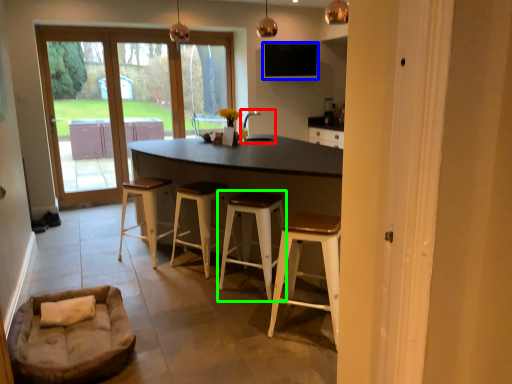
Question: Which is nearer to the sink (highlighted by a red box)? window screen (highlighted by a blue box) or stool (highlighted by a green box).

Choices:
 (A) window screen
 (B) stool

Answer: (B)